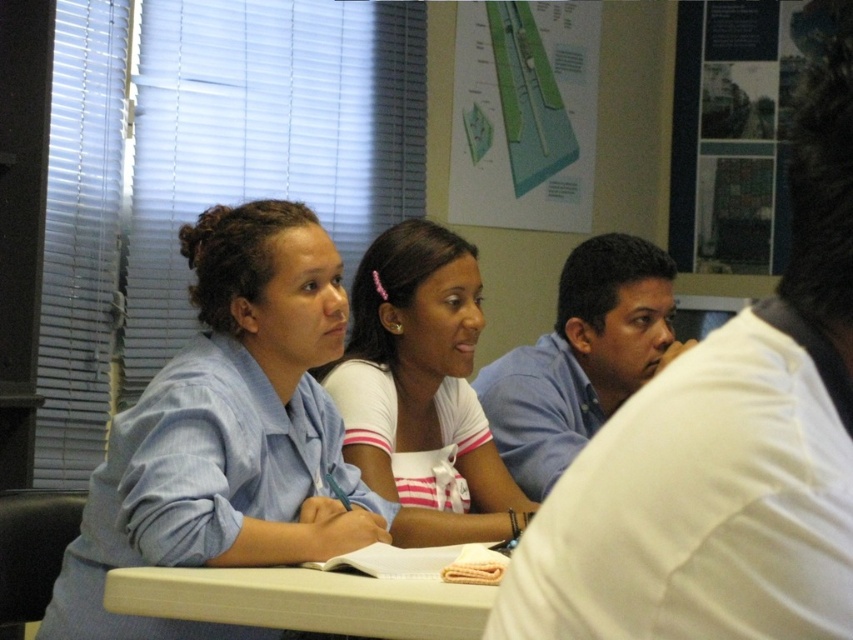
Is point (808, 413) positioned before point (190, 582)?

Yes, it is.

The image size is (853, 640). What are the coordinates of `blue shirt at center` in the screenshot? It's located at (723, 451).

Based on the photo, is blue striped shirt at upper left closer to the viewer compared to white plastic table at lower center?

No, blue striped shirt at upper left is further to the viewer.

Can you confirm if blue striped shirt at upper left is shorter than white plastic table at lower center?

No.

Find the location of a particular element. Image resolution: width=853 pixels, height=640 pixels. blue striped shirt at upper left is located at coordinates (227, 432).

Who is higher up, blue shirt at center or white matte shirt at center?

blue shirt at center is higher up.

Does blue shirt at center have a greater width compared to white matte shirt at center?

In fact, blue shirt at center might be narrower than white matte shirt at center.

Identify the location of blue shirt at center. (723, 451).